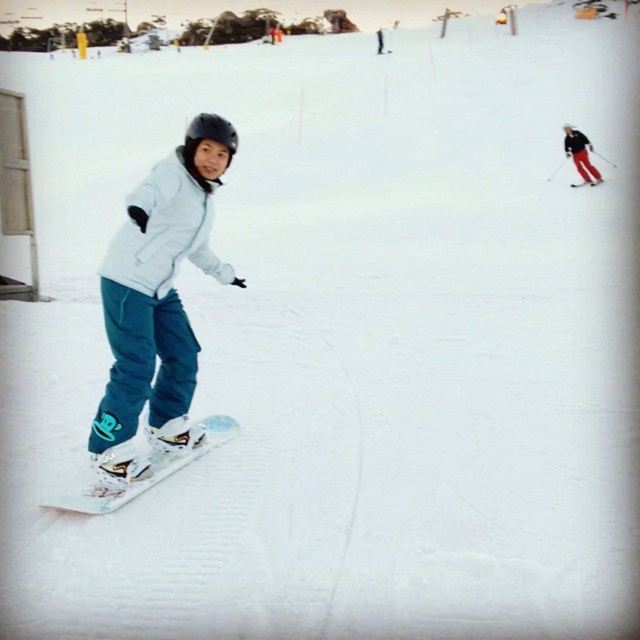
You are a photographer trying to capture the snowboarder and the skier in a single shot. Based on the scene, which object, the teal matte snow pants at left or the white glossy snowboard at lower left, would require you to adjust your camera focus more because it is wider?

The white glossy snowboard at lower left requires more focus adjustment because it is wider than the teal matte snow pants at left.

You are a photographer trying to capture the width of objects in the scene. Which object has a greater width between the white glossy snowboard at lower left and the matte red ski pants at right?

The white glossy snowboard at lower left has a greater width than the matte red ski pants at right.

You are a photographer trying to capture the snowboarder and the skier in the image. You want to ensure both subjects are in focus. Given that your camera can only focus on objects within a 0.15 unit range from the focal point, where should you set your focal point to include both point (58, 502) and point (576, 148)?

To include both points within the 0.15 unit range, the focal point should be set at the midpoint between point (58, 502) and point (576, 148). The midpoint is calculated as the average of their coordinates, resulting in approximately point 0.510, 0.495. This ensures both points are within the 0.15 unit range from the focal point.